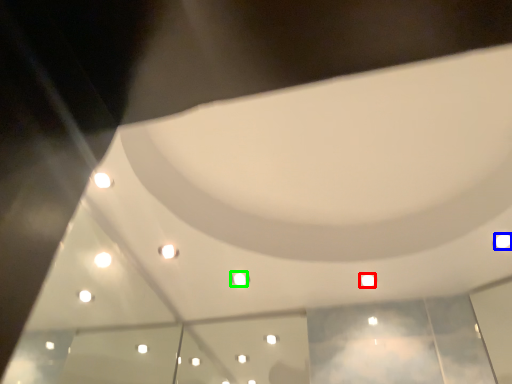
Question: Considering the real-world distances, which object is farthest from light (highlighted by a red box)? light (highlighted by a blue box) or light (highlighted by a green box)?

Choices:
 (A) light
 (B) light

Answer: (B)